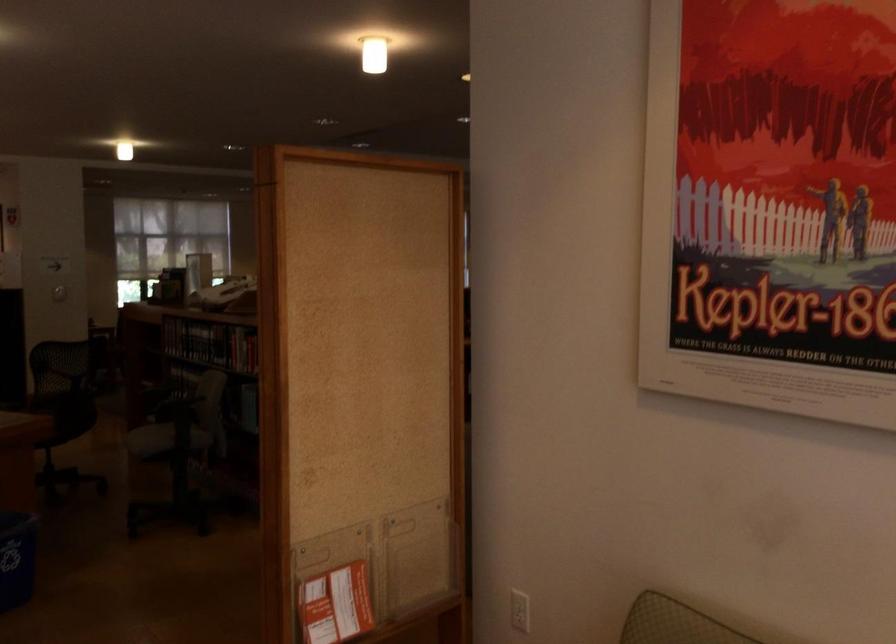
The location [336,605] corresponds to which object?

This point indicates the red paper pamphlet.